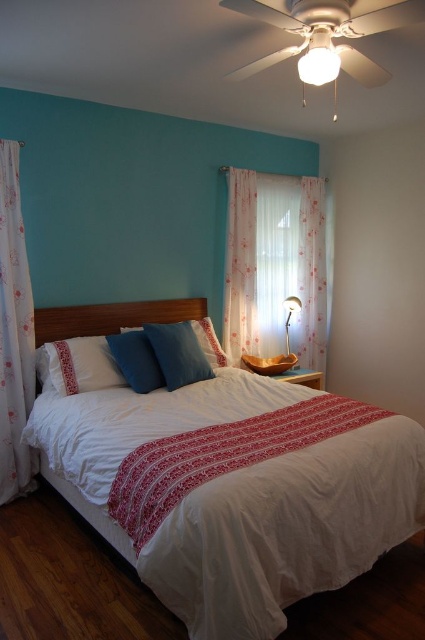
Question: Among these objects, which one is farthest from the camera?

Choices:
 (A) wooden headboard at center
 (B) blue matte pillow at center
 (C) sheer floral fabric curtain at center
 (D) matte blue pillow at center

Answer: (C)

Question: Does blue matte pillow at center appear on the left side of matte blue pillow at center?

Choices:
 (A) no
 (B) yes

Answer: (A)

Question: Among these points, which one is nearest to the camera?

Choices:
 (A) (252, 221)
 (B) (158, 346)
 (C) (108, 372)
 (D) (285, 326)

Answer: (C)

Question: Can you confirm if floral sheer curtain at left is bigger than metallic gold lamp at right?

Choices:
 (A) yes
 (B) no

Answer: (A)

Question: Which point is closer to the camera taking this photo?

Choices:
 (A) (48, 376)
 (B) (297, 442)
 (C) (221, 554)

Answer: (C)

Question: From the image, what is the correct spatial relationship of blue matte pillow at center in relation to metallic gold lamp at right?

Choices:
 (A) left
 (B) right

Answer: (A)